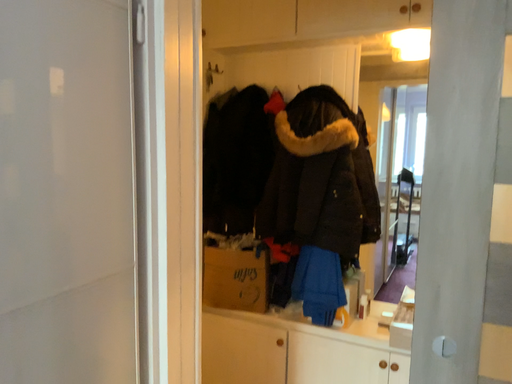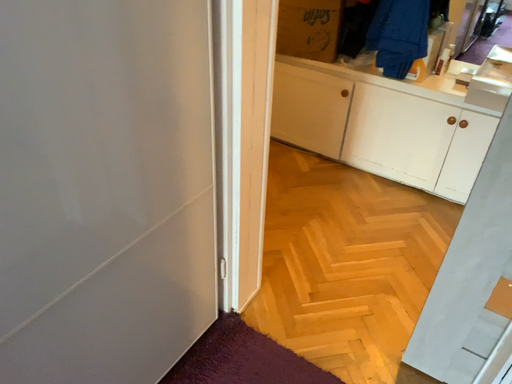
Question: How did the camera likely rotate when shooting the video?

Choices:
 (A) rotated right
 (B) rotated left

Answer: (B)